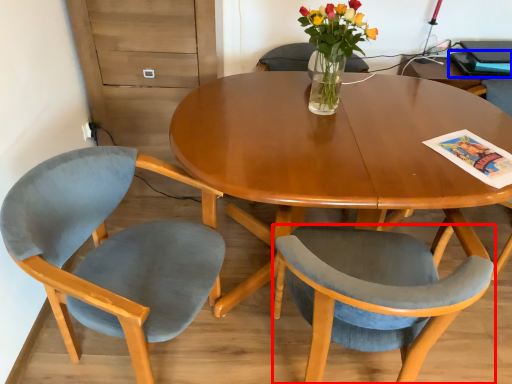
Question: Which point is closer to the camera, chair (highlighted by a red box) or magazine (highlighted by a blue box)?

Choices:
 (A) chair
 (B) magazine

Answer: (A)